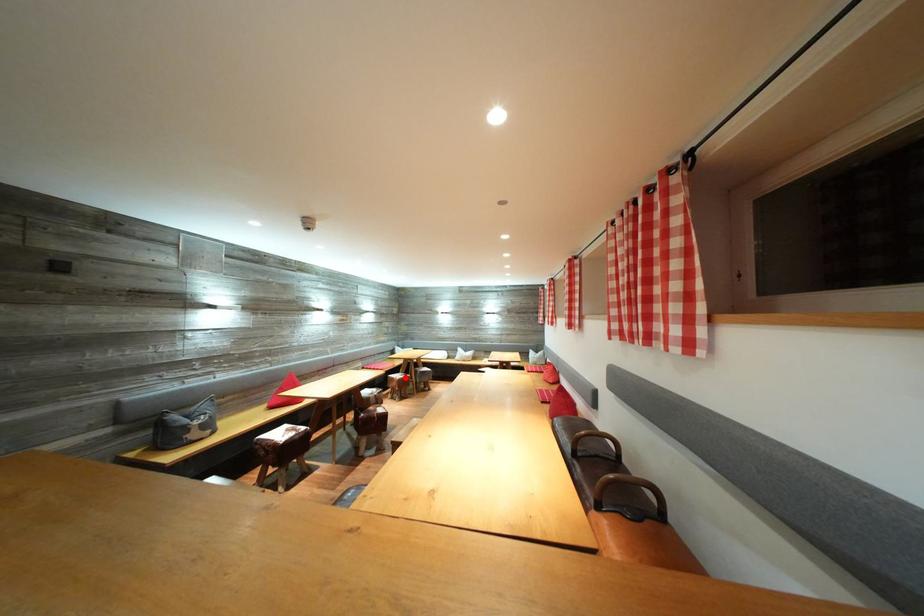
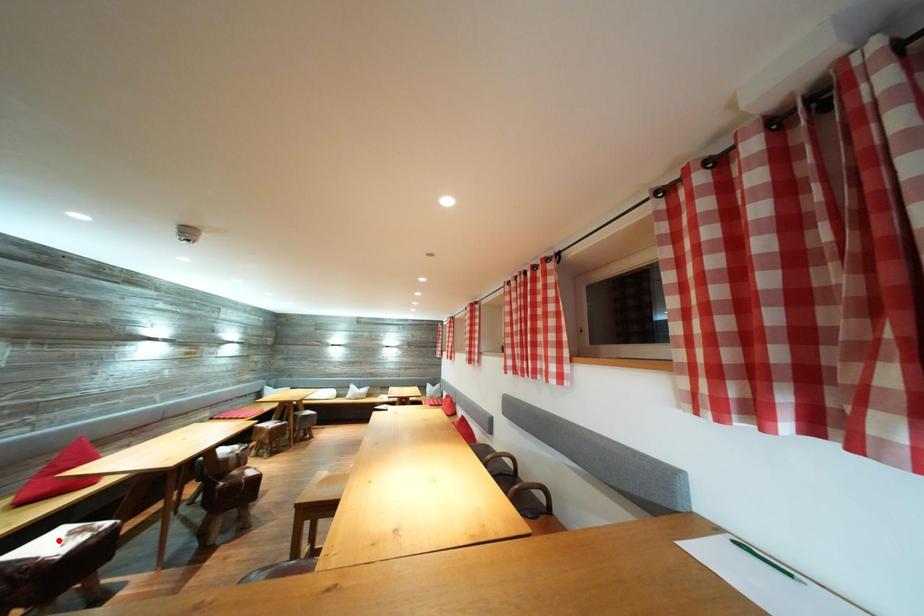
I am providing you with two images of the same scene from different viewpoints. A red point is marked on the first image and another point is marked on the second image. Are the points marked in image1 and image2 representing the same 3D position?

No